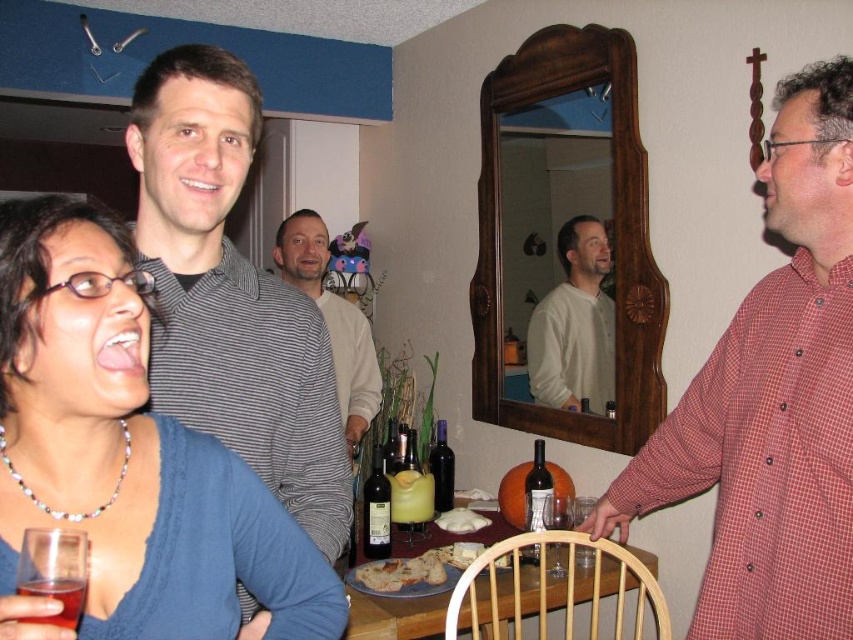
You are a guest at the party and need to sit down. You see the red checkered shirt at right and the wooden table at center. Which object is larger and would be more suitable for sitting?

The wooden table at center is larger than the red checkered shirt at right. However, the wooden table at center is meant for placing items like the wine bottle and plates, not for sitting. The red checkered shirt at right is smaller and likely belongs to a person, so neither is suitable for sitting. You should look for a chair or bench instead.

You are a guest at this party and want to grab the dark glass bottle at table center to pour yourself a drink. However, there is a striped shirt at center in the way. Can you reach the bottle without moving the shirt?

The striped shirt at center is located above the dark glass bottle at table center, so you would need to move the shirt to access the bottle.